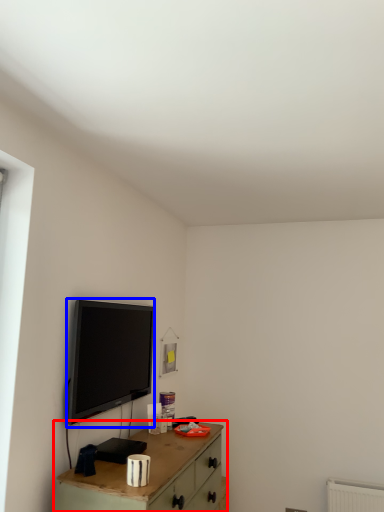
Question: Among these objects, which one is nearest to the camera, table (highlighted by a red box) or television (highlighted by a blue box)?

Choices:
 (A) table
 (B) television

Answer: (A)